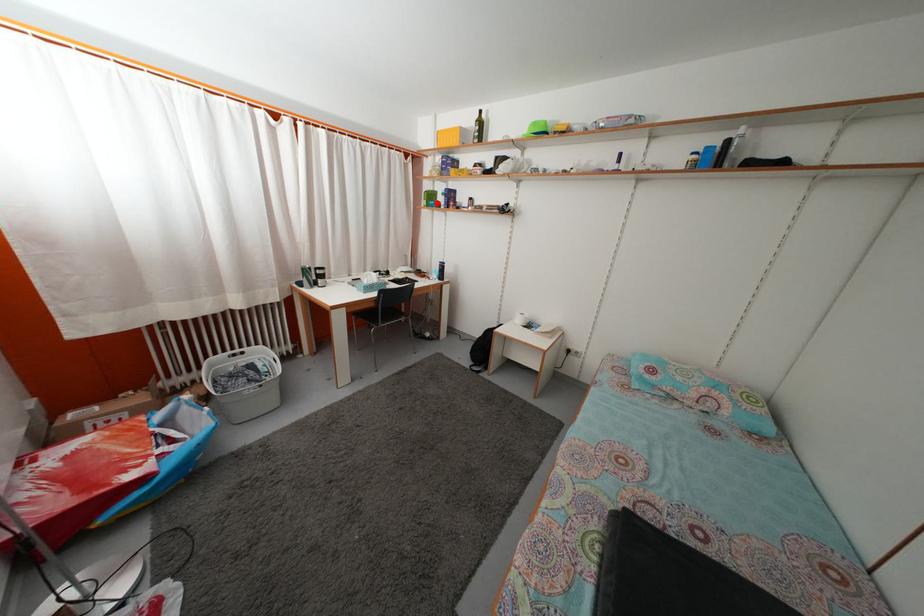
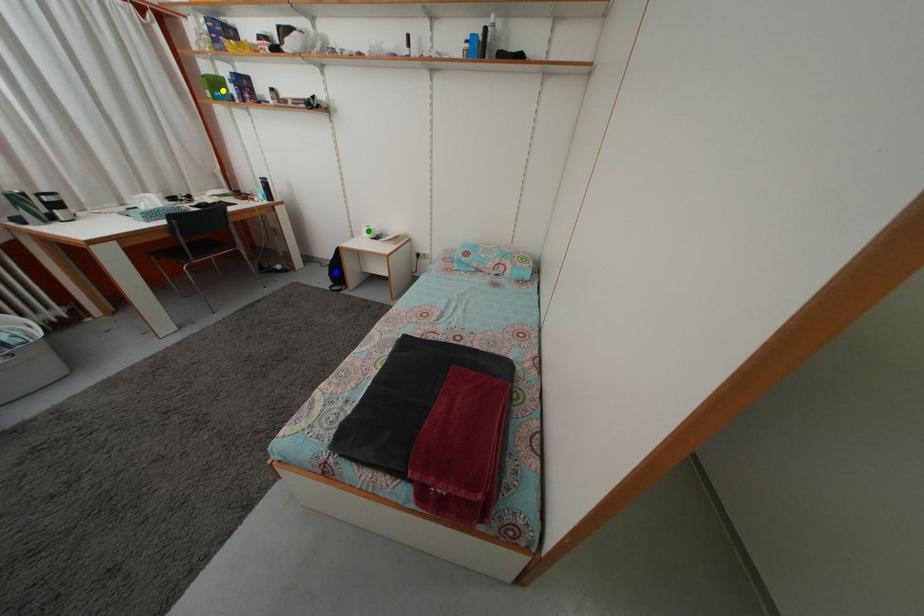
Question: I am providing you with two images of the same scene from different viewpoints. A red point is marked on the first image. You are given multiple points on the second image. Can you choose the point in image 2 that corresponds to the point in image 1?

Choices:
 (A) blue point
 (B) yellow point
 (C) green point

Answer: (B)